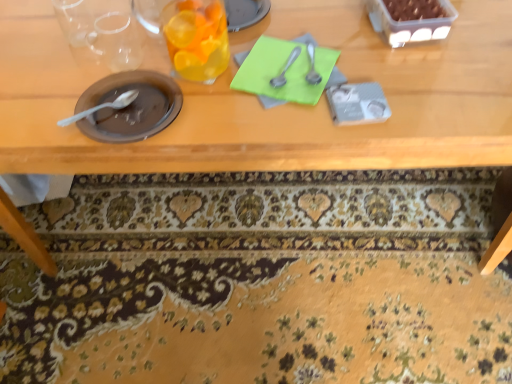
Where is `vacant space in between matte brown plate at left, the first tableware viewed from the left, and green paper at center`? The height and width of the screenshot is (384, 512). vacant space in between matte brown plate at left, the first tableware viewed from the left, and green paper at center is located at coordinates (205, 99).